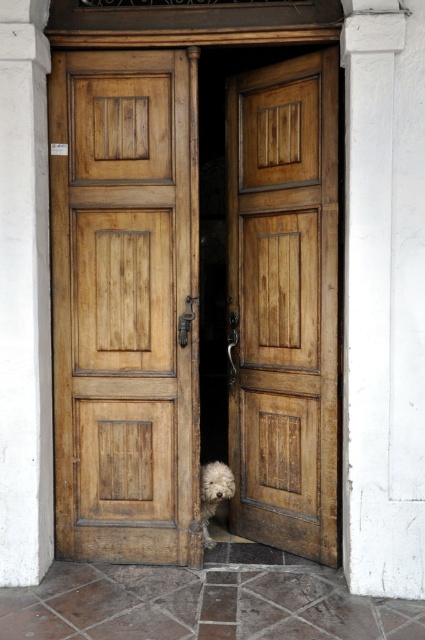
Is white marble pillar at right taller than white fluffy dog at lower center?

Yes.

Which is above, white marble pillar at right or white fluffy dog at lower center?

white marble pillar at right

Is point (410, 160) farther from camera compared to point (212, 500)?

No, it is in front of (212, 500).

Image resolution: width=425 pixels, height=640 pixels. Find the location of `white marble pillar at right`. white marble pillar at right is located at coordinates (384, 298).

Which is in front, point (314, 161) or point (376, 246)?

Point (376, 246) is more forward.

How distant is wooden panelled door at center from white marble pillar at right?

wooden panelled door at center and white marble pillar at right are 47.93 centimeters apart from each other.

Is point (297, 67) positioned before point (359, 104)?

No, (297, 67) is behind (359, 104).

I want to click on wooden panelled door at center, so (x=283, y=301).

Is point (244, 81) positioned behind point (42, 81)?

That is True.

At what (x,y) coordinates should I click in order to perform the action: click on wooden panelled door at center. Please return your answer as a coordinate pair (x, y). This screenshot has height=640, width=425. Looking at the image, I should click on (283, 301).